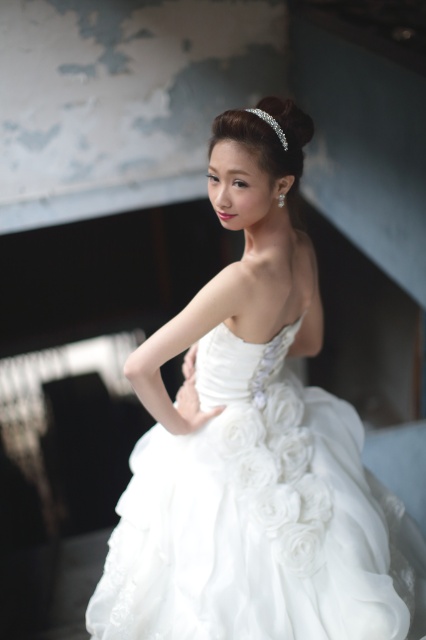
Can you confirm if white satin dress at center is positioned above clear crystal tiara at upper center?

Incorrect, white satin dress at center is not positioned above clear crystal tiara at upper center.

Is white satin dress at center bigger than clear crystal tiara at upper center?

Indeed, white satin dress at center has a larger size compared to clear crystal tiara at upper center.

Between point (316, 513) and point (278, 138), which one is positioned in front?

Point (278, 138) is more forward.

Where is `white satin dress at center`? This screenshot has height=640, width=426. white satin dress at center is located at coordinates (247, 442).